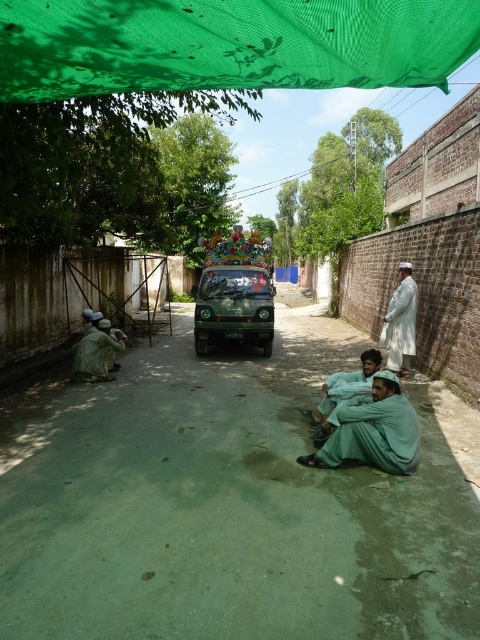
You are a delivery person trying to navigate through the green concrete alley at center while carrying a large package. There is also a green fabric robe at lower center in the way. Can you pass through the alley without moving the robe?

The green concrete alley at center might be wider than green fabric robe at lower center, so there is a possibility that the delivery person can pass through without moving the robe, but it depends on the exact width difference.

You are standing at the point marked as point (x=233, y=307) in the alleyway. What object is located exactly at that point?

The green matte jeep at center is located exactly at point (x=233, y=307).